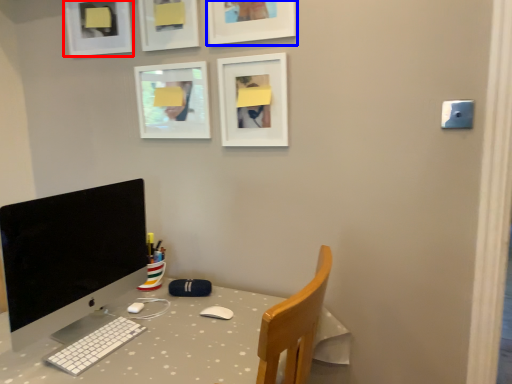
Question: Among these objects, which one is farthest to the camera, picture frame (highlighted by a red box) or picture frame (highlighted by a blue box)?

Choices:
 (A) picture frame
 (B) picture frame

Answer: (A)